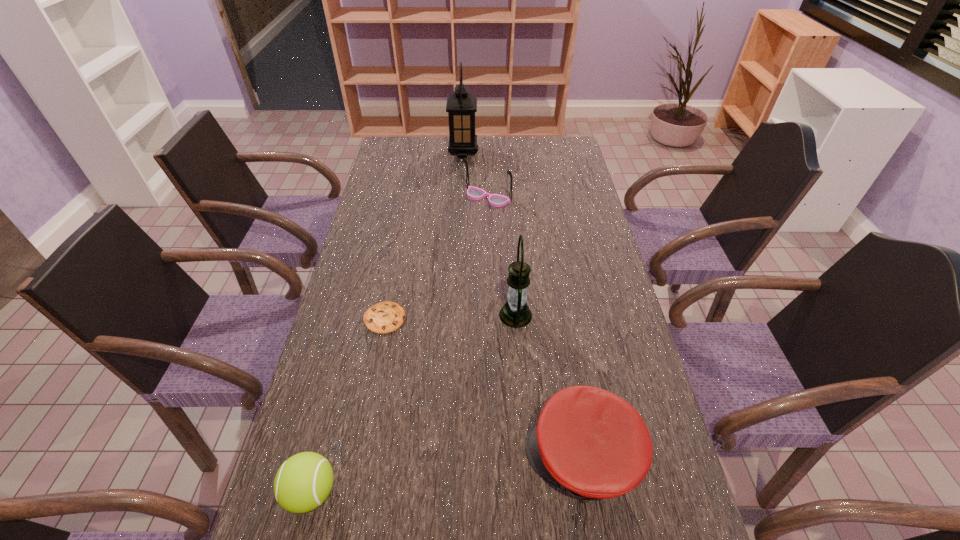
Locate an element on the screen. The image size is (960, 540). the farthest object is located at coordinates (461, 106).

Locate an element on the screen. the tallest object is located at coordinates (461, 106).

Where is `the right lantern`? The image size is (960, 540). the right lantern is located at coordinates (515, 313).

Find the location of `the second tallest object`. the second tallest object is located at coordinates (515, 313).

You are a GUI agent. You are given a task and a screenshot of the screen. Output one action in this format:
    pyautogui.click(x=<x>, y=<y>)
    Task: Click on the third tallest object
    Image resolution: width=960 pixels, height=540 pixels.
    Given the screenshot: What is the action you would take?
    pyautogui.click(x=474, y=193)

Where is `spectacles`? spectacles is located at coordinates (474, 193).

The width and height of the screenshot is (960, 540). What are the coordinates of `cap` in the screenshot? It's located at (593, 444).

Locate an element on the screen. This screenshot has height=540, width=960. tennis ball is located at coordinates (304, 481).

Where is `the shortest object`? the shortest object is located at coordinates (384, 317).

Where is `vacant area situated on the front of the left lantern`? This screenshot has width=960, height=540. vacant area situated on the front of the left lantern is located at coordinates pos(462,175).